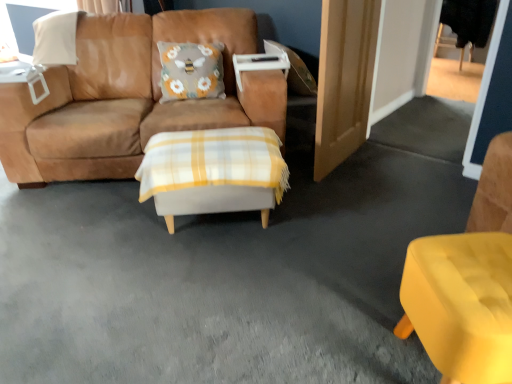
Question: Based on their sizes in the image, would you say matte yellow chair at lower right is bigger or smaller than suede brown couch at center?

Choices:
 (A) big
 (B) small

Answer: (B)

Question: In the image, is matte yellow chair at lower right positioned in front of or behind suede brown couch at center?

Choices:
 (A) front
 (B) behind

Answer: (A)

Question: Based on their relative distances, which object is nearer to the matte yellow chair at lower right?

Choices:
 (A) wooden door at right
 (B) white plaid ottoman at center, arranged as the 2th table when viewed from the top
 (C) suede brown couch at center
 (D) white plastic table at upper left, acting as the second table starting from the front

Answer: (B)

Question: Considering the real-world distances, which object is farthest from the white plaid ottoman at center, acting as the 1th table starting from the front?

Choices:
 (A) wooden door at right
 (B) white plastic table at upper left, which is counted as the 1th table, starting from the left
 (C) matte yellow chair at lower right
 (D) suede brown couch at center

Answer: (B)